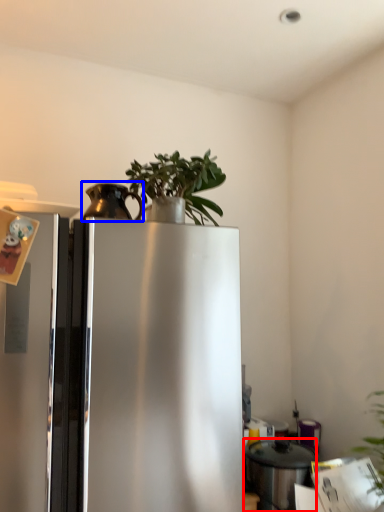
Question: Which object appears farthest to the camera in this image, appliance (highlighted by a red box) or appliance (highlighted by a blue box)?

Choices:
 (A) appliance
 (B) appliance

Answer: (A)